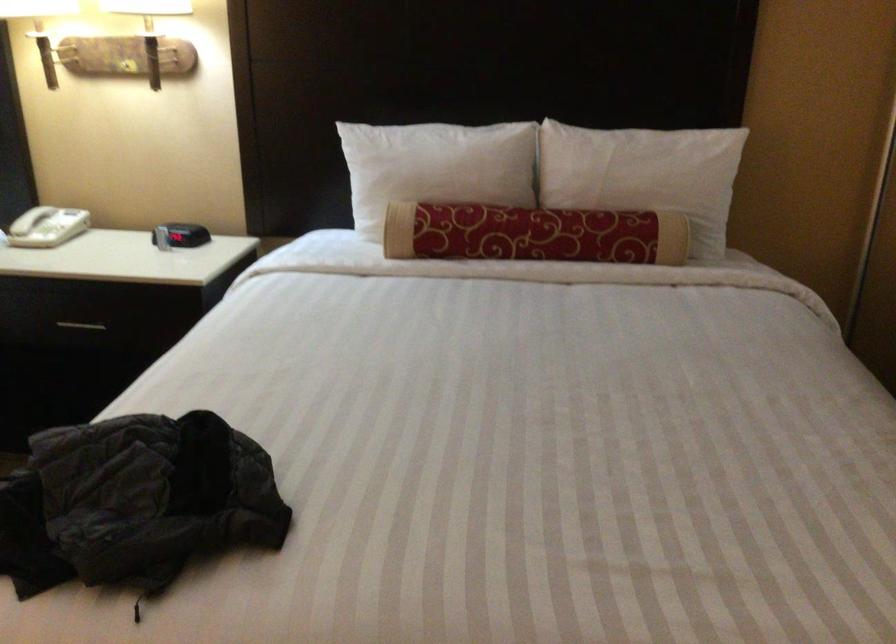
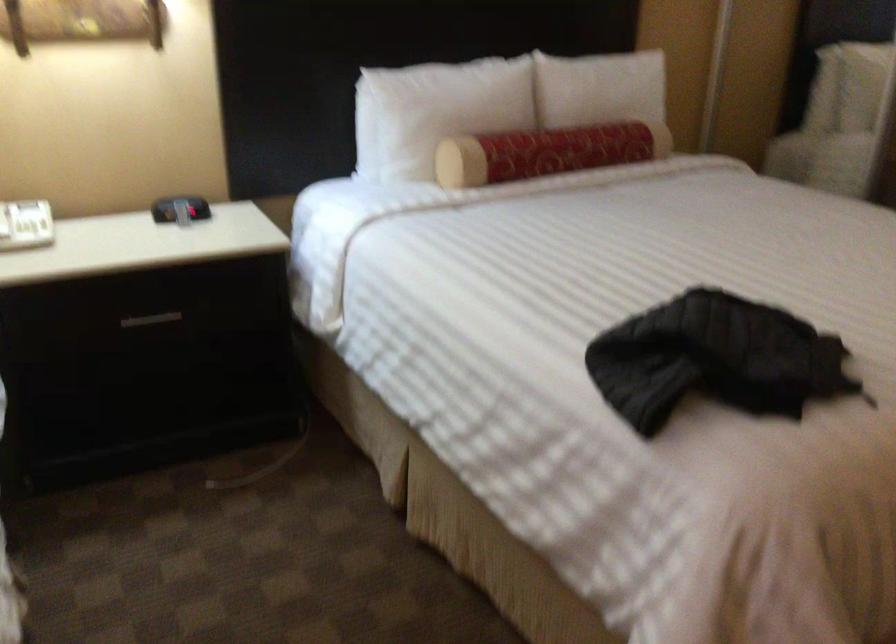
The point at (78, 321) is marked in the first image. Where is the corresponding point in the second image?

(151, 319)